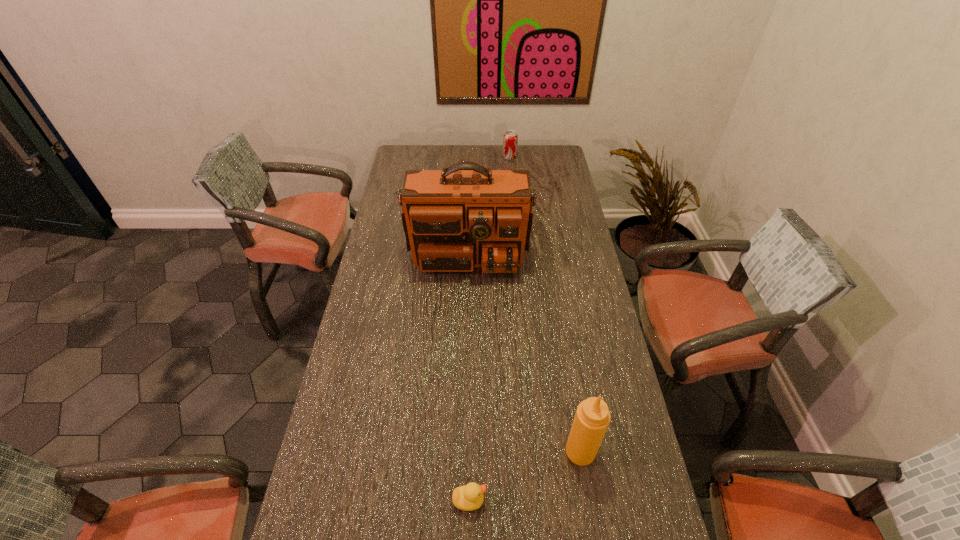
Where is `the tallest object`? The height and width of the screenshot is (540, 960). the tallest object is located at coordinates (463, 216).

Where is `the second farthest object`? This screenshot has height=540, width=960. the second farthest object is located at coordinates (463, 216).

Identify the location of the second tallest object. Image resolution: width=960 pixels, height=540 pixels. (592, 417).

Find the location of a particular element. the rightmost object is located at coordinates (592, 417).

This screenshot has height=540, width=960. I want to click on soda can, so [510, 139].

At what (x,y) coordinates should I click in order to perform the action: click on the farthest object. Please return your answer as a coordinate pair (x, y). Looking at the image, I should click on (510, 139).

Locate an element on the screen. the shortest object is located at coordinates (469, 497).

I want to click on duckling, so click(x=469, y=497).

At what (x,y) coordinates should I click in order to perform the action: click on vacant space located on the face side of the satchel. Please return your answer as a coordinate pair (x, y). The width and height of the screenshot is (960, 540). Looking at the image, I should click on (466, 359).

Image resolution: width=960 pixels, height=540 pixels. In order to click on vacant space situated on the back of the condiment in this screenshot , I will do `click(567, 368)`.